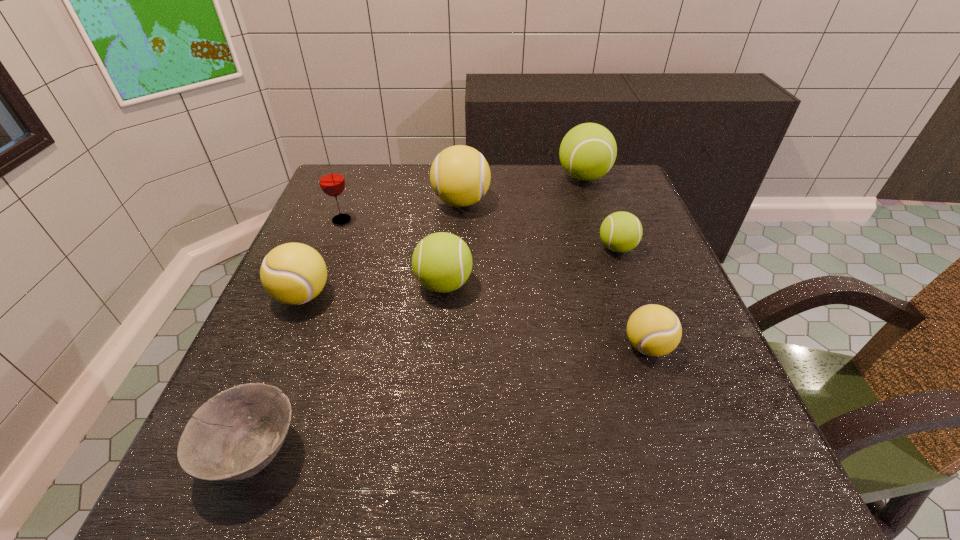
I want to click on empty location between the farthest green tennis ball and the third farthest tennis ball, so click(x=600, y=212).

This screenshot has height=540, width=960. In order to click on free space between the biggest green tennis ball and the nearest yellow tennis ball in this screenshot , I will do `click(615, 262)`.

Find the location of a particular element. This screenshot has width=960, height=540. vacant space in between the rightmost yellow tennis ball and the nearest green tennis ball is located at coordinates (545, 315).

Where is `vacant space in between the leftmost green tennis ball and the nearest tennis ball`? The width and height of the screenshot is (960, 540). vacant space in between the leftmost green tennis ball and the nearest tennis ball is located at coordinates (545, 315).

Select which object is the sixth closest to the seventh farthest object. Please provide its 2D coordinates. Your answer should be formatted as a tuple, i.e. [(x, y)], where the tuple contains the x and y coordinates of a point satisfying the conditions above.

[(293, 273)]

Where is `the closest object to the fourth nearest tennis ball`? the closest object to the fourth nearest tennis ball is located at coordinates (654, 330).

Choose which tennis ball is the fifth nearest neighbor to the bowl. Please provide its 2D coordinates. Your answer should be formatted as a tuple, i.e. [(x, y)], where the tuple contains the x and y coordinates of a point satisfying the conditions above.

[(620, 232)]

This screenshot has height=540, width=960. I want to click on tennis ball that is the fifth closest to the fourth nearest tennis ball, so click(x=293, y=273).

Locate an element on the screen. The width and height of the screenshot is (960, 540). green tennis ball object that ranks as the second closest to the leftmost yellow tennis ball is located at coordinates (620, 232).

Locate an element on the screen. This screenshot has width=960, height=540. green tennis ball that is the closest to the second nearest object is located at coordinates coord(620,232).